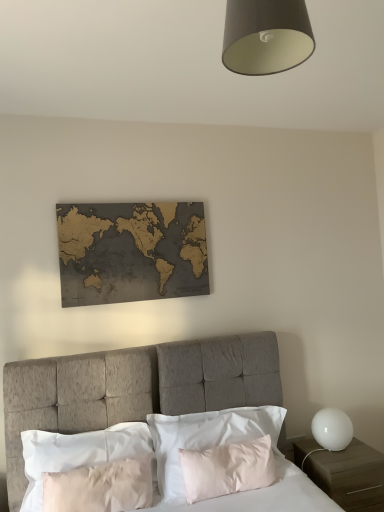
Question: Is white matte nightstand at lower right bigger or smaller than white matte globe at right?

Choices:
 (A) big
 (B) small

Answer: (A)

Question: Visually, is white matte nightstand at lower right positioned to the left or to the right of white matte globe at right?

Choices:
 (A) left
 (B) right

Answer: (B)

Question: Estimate the real-world distances between objects in this image. Which object is farther from the white matte nightstand at lower right?

Choices:
 (A) gold-toned wood world map at upper center
 (B) textured gray headboard at center
 (C) pale pink satin pillow at center, arranged as the first pillow when viewed from the left
 (D) silky white pillow at center, the 1th pillow positioned from the right
 (E) white matte globe at right

Answer: (A)

Question: Considering the real-world distances, which object is farthest from the gold-toned wood world map at upper center?

Choices:
 (A) silky white pillow at center, the 1th pillow positioned from the right
 (B) white matte nightstand at lower right
 (C) textured gray headboard at center
 (D) white matte globe at right
 (E) pale pink satin pillow at center, placed as the second pillow when sorted from right to left

Answer: (B)